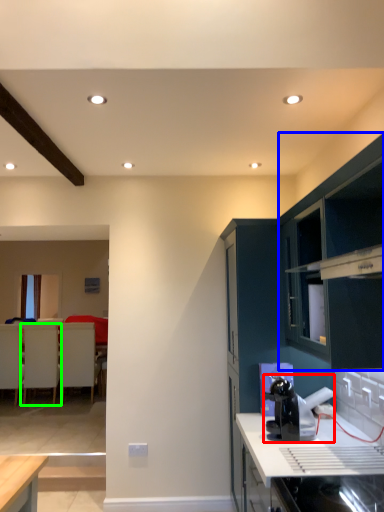
Question: Which object is positioned closest to appliance (highlighted by a red box)? Select from cabinetry (highlighted by a blue box) and armchair (highlighted by a green box).

Choices:
 (A) cabinetry
 (B) armchair

Answer: (A)